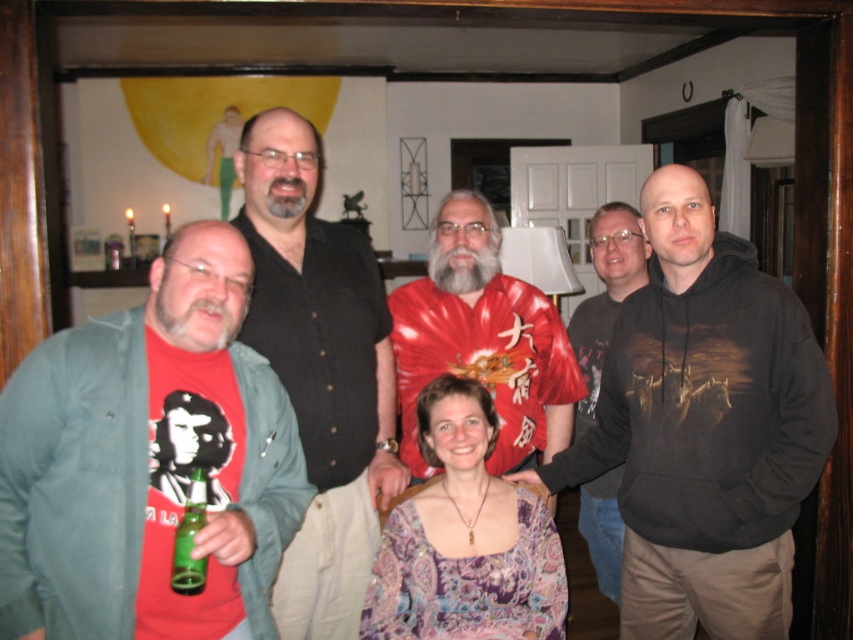
You are standing in the room and want to find the point at coordinates (705, 428). Which object is this point located on?

The point at coordinates (705, 428) is located on the dark gray hoodie at right.